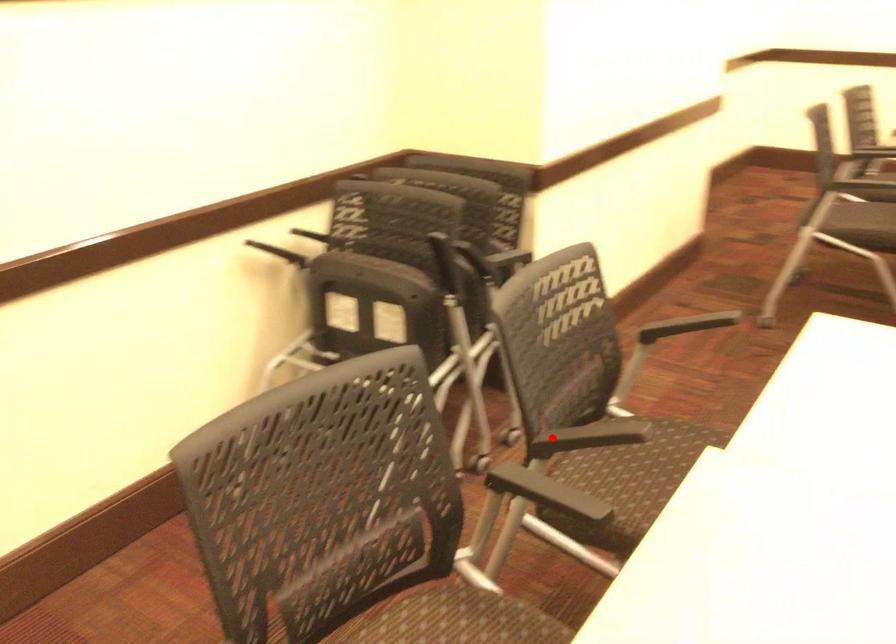
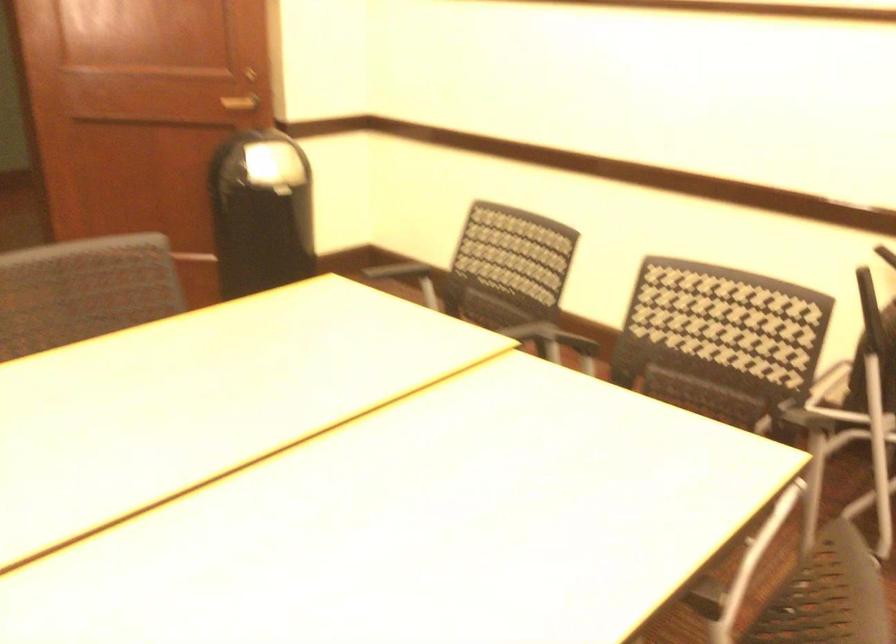
Question: I am providing you with two images of the same scene from different viewpoints. In image1, a red point is highlighted. Considering the same 3D point in image2, which of the following is correct?

Choices:
 (A) It is closer
 (B) It is farther

Answer: (B)